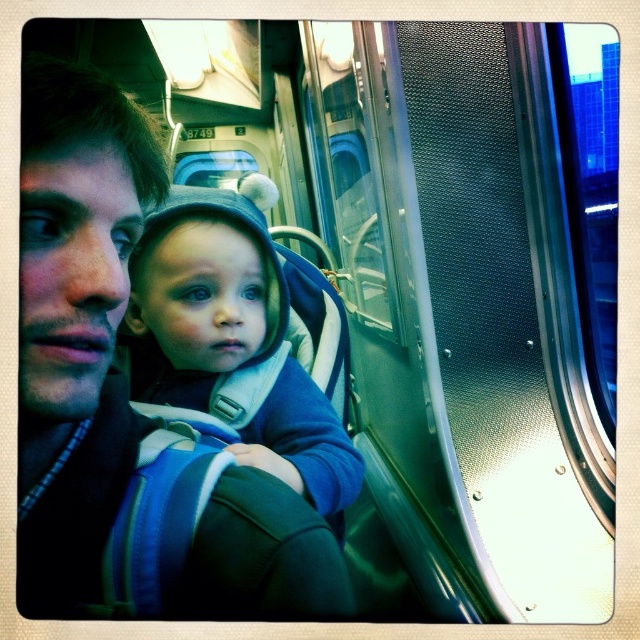
Question: Can you confirm if matte black jacket at left is wider than blue fleece jacket at center?

Choices:
 (A) yes
 (B) no

Answer: (B)

Question: Where is matte black jacket at left located in relation to blue fleece jacket at center in the image?

Choices:
 (A) above
 (B) below

Answer: (A)

Question: Among these points, which one is farthest from the camera?

Choices:
 (A) pos(77,579)
 (B) pos(168,324)

Answer: (B)

Question: Which point is closer to the camera taking this photo?

Choices:
 (A) (212, 349)
 (B) (173, 452)

Answer: (B)

Question: From the image, what is the correct spatial relationship of matte black jacket at left in relation to blue fleece jacket at center?

Choices:
 (A) right
 (B) left

Answer: (B)